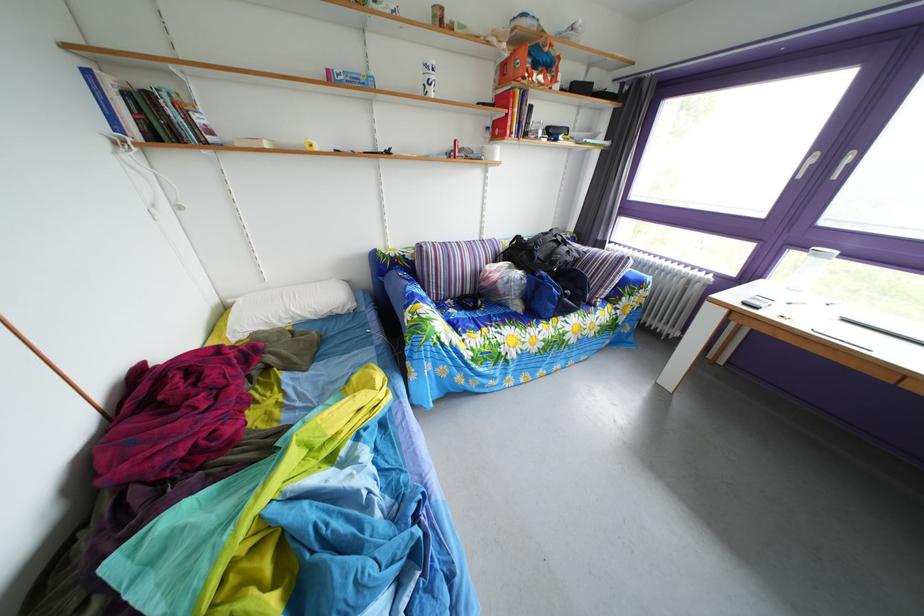
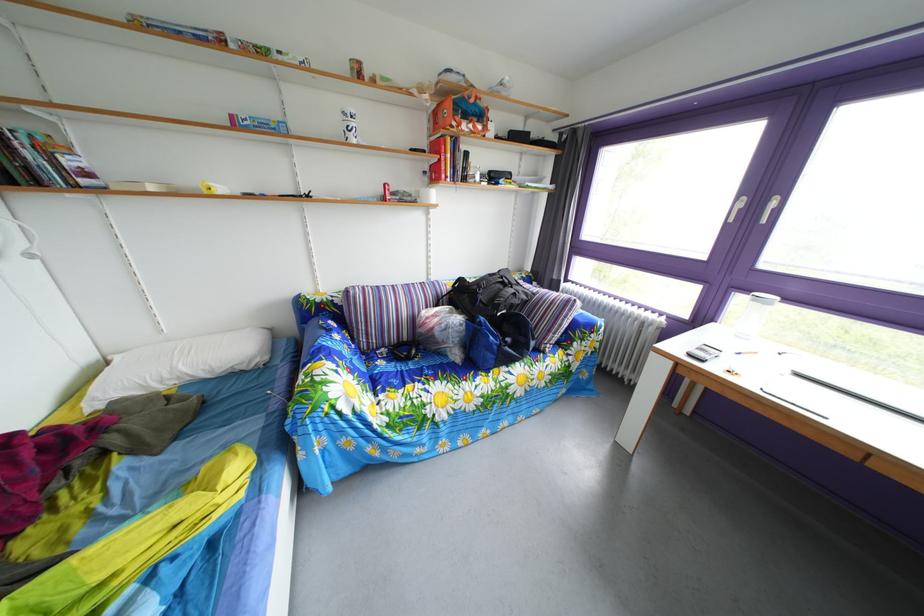
Which direction would the cameraman need to move to produce the second image?

The cameraman walked toward right, forward.